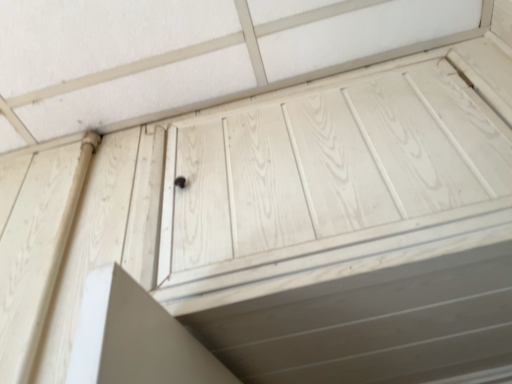
The image size is (512, 384). Describe the element at coordinates (216, 62) in the screenshot. I see `white wood panel at upper center` at that location.

What is the approximate height of white wood panel at upper center?

2.04 inches.

In order to click on white wood panel at upper center in this screenshot , I will do `click(216, 62)`.

The image size is (512, 384). I want to click on white wood panel at upper center, so click(216, 62).